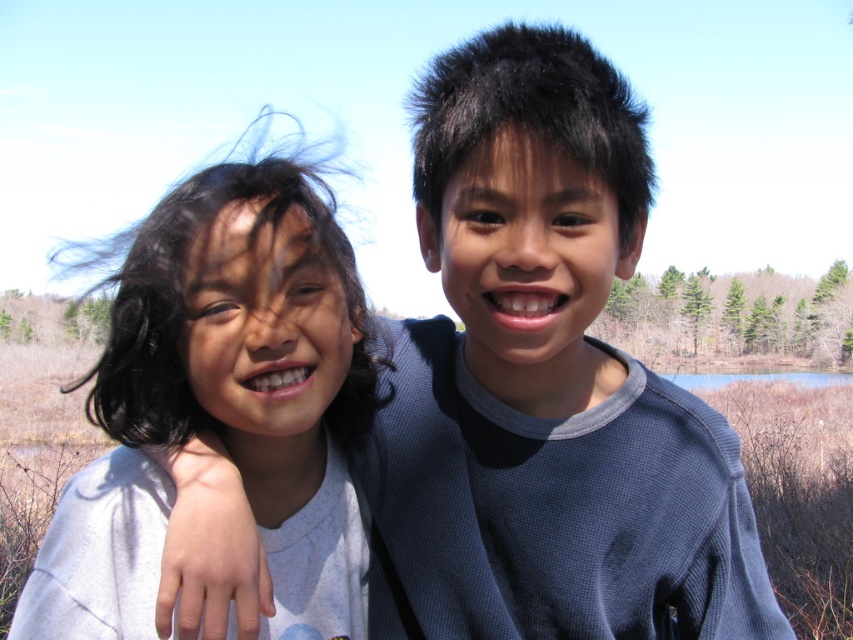
Based on the photo, is gray thermal shirt at center to the left of white matte shirt at left from the viewer's perspective?

Incorrect, gray thermal shirt at center is not on the left side of white matte shirt at left.

Between point (619, 541) and point (155, 369), which one is positioned behind?

Point (619, 541)

Does point (585, 211) come behind point (132, 417)?

No, (585, 211) is in front of (132, 417).

This screenshot has height=640, width=853. I want to click on gray thermal shirt at center, so click(544, 384).